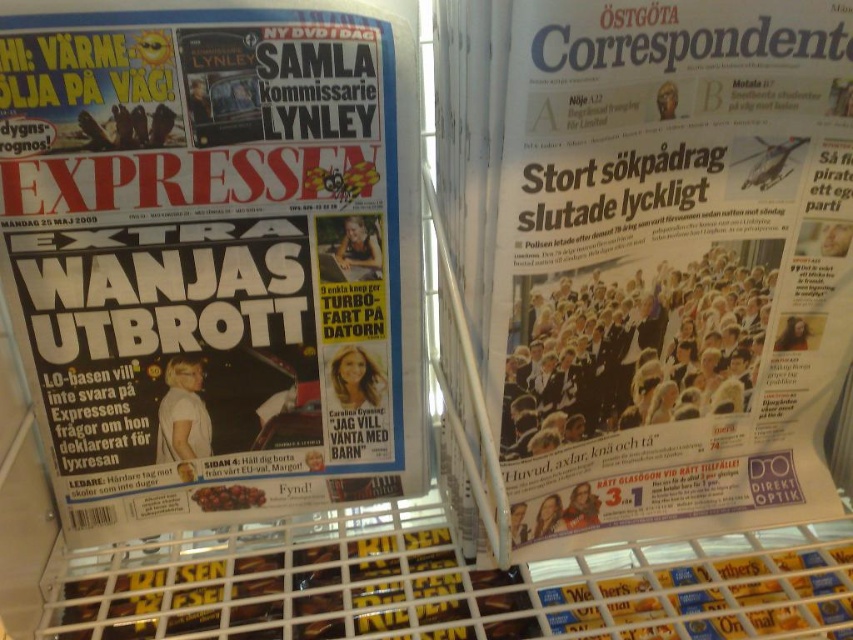
Based on the photo, you are a customer trying to read the headlines of the matte black newspaper at center and the white glossy paper at upper center. Which one is positioned higher on the rack?

The matte black newspaper at center is positioned higher than the white glossy paper at upper center because it is above it according to the description.